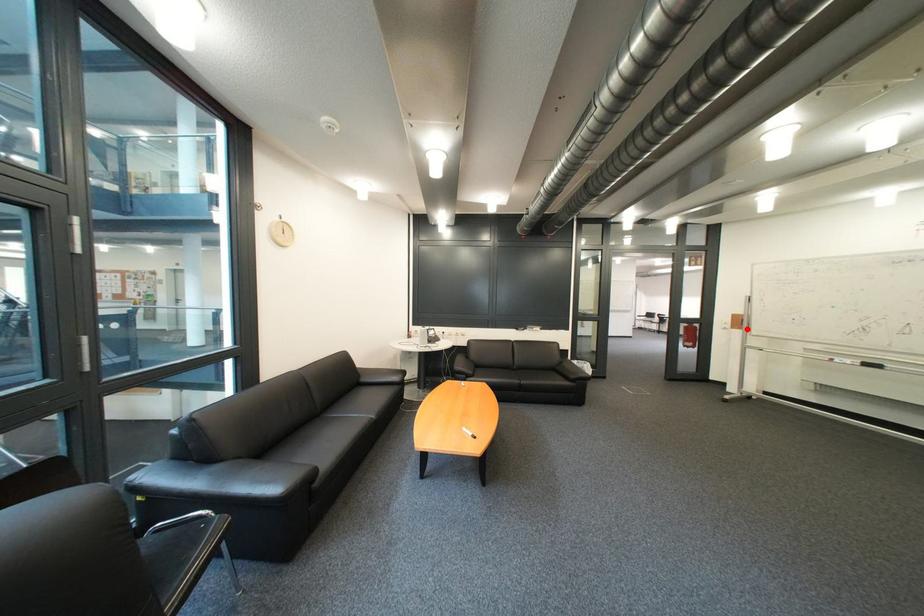
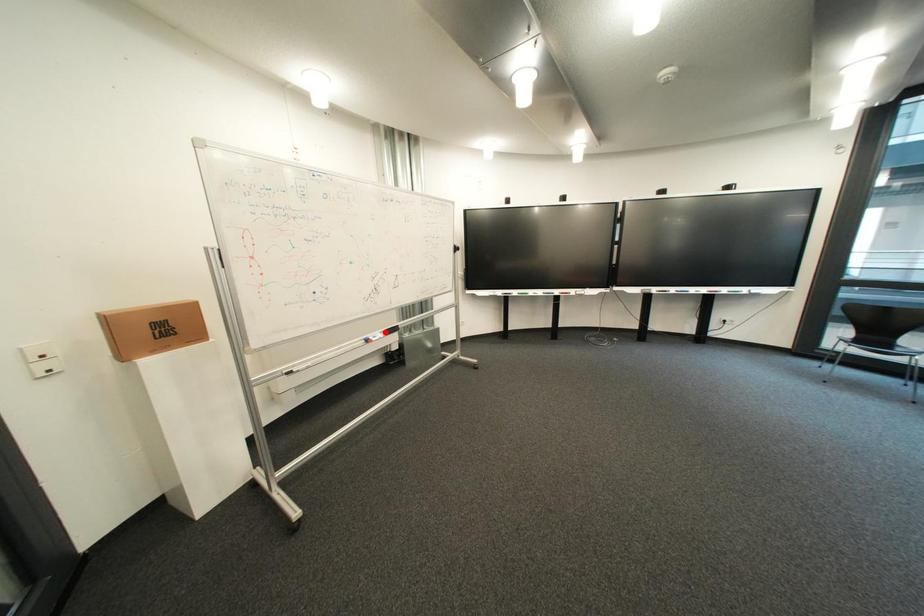
I am providing you with two images of the same scene from different viewpoints. A red point is marked on the first image and another point is marked on the second image. Is the red point in image1 aligned with the point shown in image2?

No